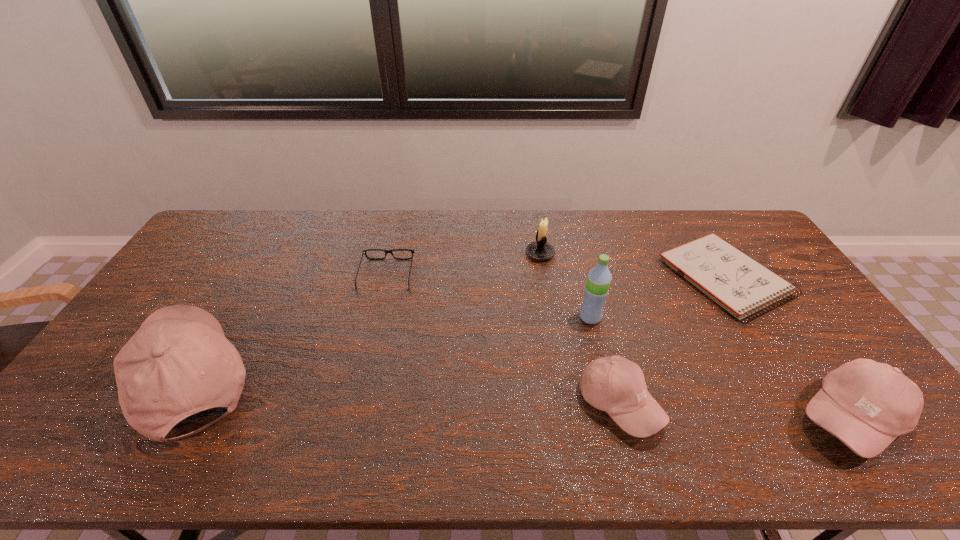
Identify the location of vacant space located 0.080m on the front-facing side of the leftmost object. (96, 378).

Where is `vacant space situated 0.080m on the front-facing side of the leftmost object`? vacant space situated 0.080m on the front-facing side of the leftmost object is located at coordinates (96, 378).

At what (x,y) coordinates should I click in order to perform the action: click on free location located 0.260m on the front-facing side of the fifth tallest object. Please return your answer as a coordinate pair (x, y). Image resolution: width=960 pixels, height=540 pixels. Looking at the image, I should click on (762, 404).

At what (x,y) coordinates should I click in order to perform the action: click on free space located 0.270m on the front of the candle holder. Please return your answer as a coordinate pair (x, y). This screenshot has width=960, height=540. Looking at the image, I should click on (551, 322).

At what (x,y) coordinates should I click in order to perform the action: click on vacant region located 0.390m on the left of the shortest object. Please return your answer as a coordinate pair (x, y). The height and width of the screenshot is (540, 960). Looking at the image, I should click on (547, 278).

Identify the location of vacant space situated on the front-facing side of the sixth object from right to left. (396, 233).

The width and height of the screenshot is (960, 540). I want to click on free location located 0.230m on the front-facing side of the sixth object from right to left, so click(399, 221).

Identify the location of free space located 0.070m on the front-facing side of the sixth object from right to left. (393, 246).

Where is `free space located 0.250m on the right of the water bottle`? This screenshot has width=960, height=540. free space located 0.250m on the right of the water bottle is located at coordinates (684, 318).

Locate an element on the screen. candle holder at the far edge is located at coordinates (540, 250).